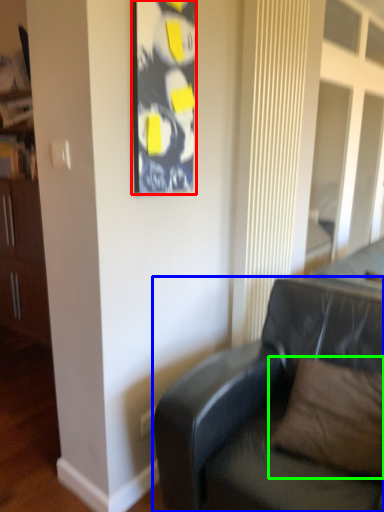
Question: Estimate the real-world distances between objects in this image. Which object is closer to picture frame (highlighted by a red box), studio couch (highlighted by a blue box) or pillow (highlighted by a green box)?

Choices:
 (A) studio couch
 (B) pillow

Answer: (A)